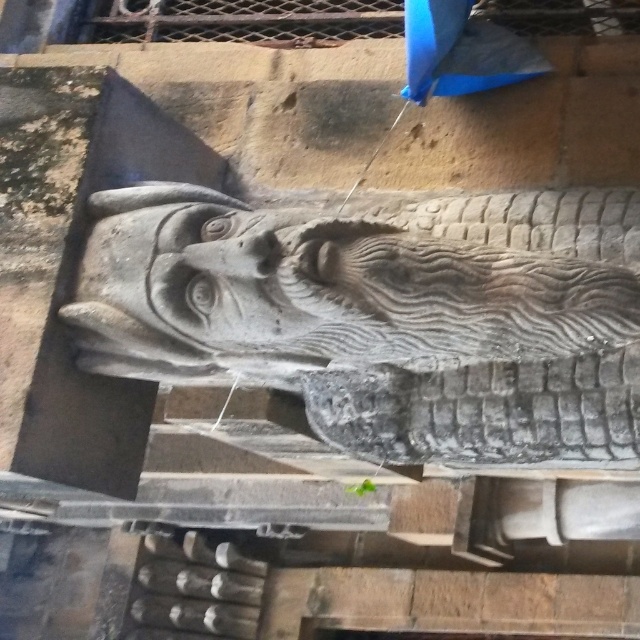
You are an art conservator assessing the placement of the gray stone dragon at center and the blue fabric umbrella at upper center. Given that the dragon is wider than the umbrella, which object would require more horizontal space for proper preservation? Please explain your reasoning based on their sizes.

The gray stone dragon at center requires more horizontal space for proper preservation because its width is larger than that of the blue fabric umbrella at upper center.

You are standing in front of an ancient stone wall and see the gray stone dragon at center and the blue fabric umbrella at upper center. Which object is closer to you?

The gray stone dragon at center is closer to you because it is in front of the blue fabric umbrella at upper center.

You are standing in front of an ancient wall with two objects in view. You see the gray stone dragon at center and the blue fabric umbrella at upper center. Which object is closer to your left side?

The gray stone dragon at center is positioned on the left side of blue fabric umbrella at upper center, so it is closer to your left side.